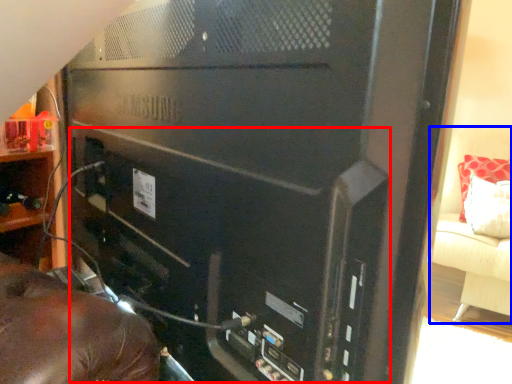
Question: Which object appears closest to the camera in this image, computer tower (highlighted by a red box) or furniture (highlighted by a blue box)?

Choices:
 (A) computer tower
 (B) furniture

Answer: (A)